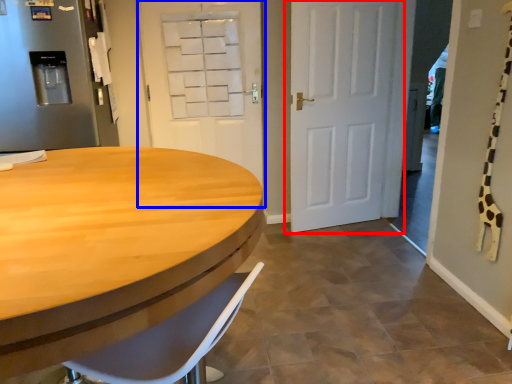
Question: Among these objects, which one is nearest to the camera, door (highlighted by a red box) or door (highlighted by a blue box)?

Choices:
 (A) door
 (B) door

Answer: (A)